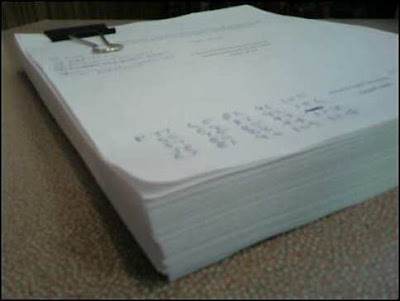
Identify the location of counter top. (52, 214), (333, 257), (49, 25).